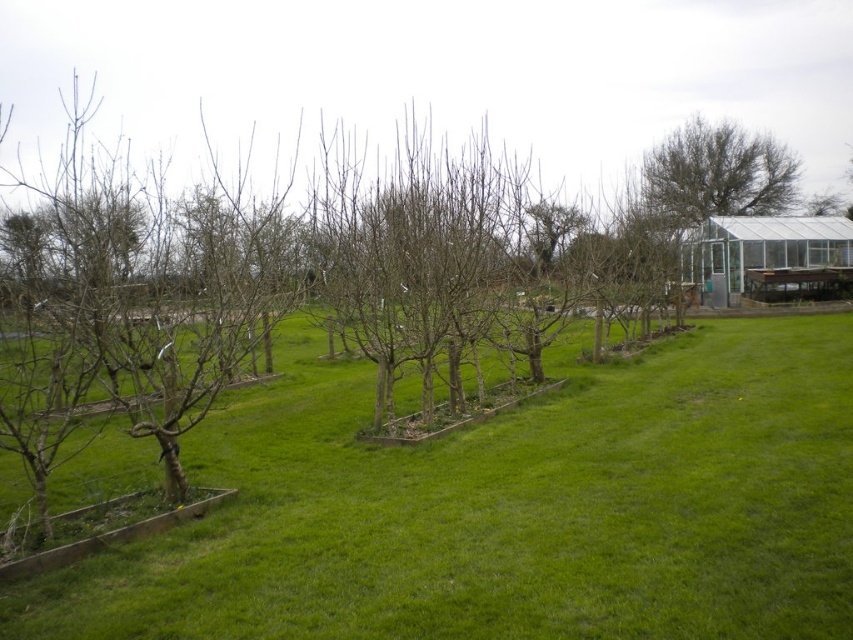
Can you confirm if green grassy at center is positioned above green leafy tree at upper right?

No.

Which is behind, point (654, 637) or point (795, 170)?

The point (795, 170) is more distant.

Find the location of a particular element. This screenshot has width=853, height=640. green grassy at center is located at coordinates (512, 512).